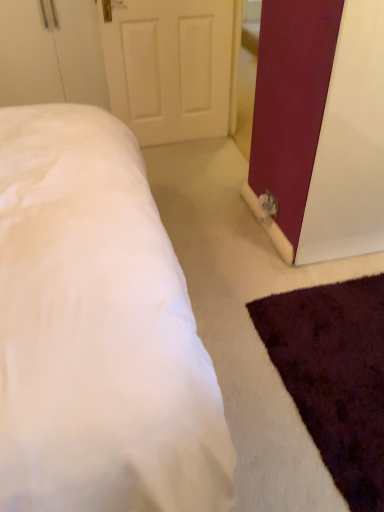
Question: Is matte burgundy barn door at right not inside white soft bed at lower left?

Choices:
 (A) yes
 (B) no

Answer: (A)

Question: From a real-world perspective, is matte burgundy barn door at right positioned over white soft bed at lower left based on gravity?

Choices:
 (A) yes
 (B) no

Answer: (A)

Question: Is matte burgundy barn door at right turned away from white soft bed at lower left?

Choices:
 (A) no
 (B) yes

Answer: (A)

Question: From a real-world perspective, is matte burgundy barn door at right positioned under white soft bed at lower left based on gravity?

Choices:
 (A) yes
 (B) no

Answer: (B)

Question: Does matte burgundy barn door at right come in front of white soft bed at lower left?

Choices:
 (A) yes
 (B) no

Answer: (B)

Question: Would you say white soft bed at lower left is to the left or to the right of matte burgundy barn door at right in the picture?

Choices:
 (A) right
 (B) left

Answer: (B)

Question: From the image's perspective, is white soft bed at lower left above or below matte burgundy barn door at right?

Choices:
 (A) below
 (B) above

Answer: (A)

Question: Considering the positions of white soft bed at lower left and matte burgundy barn door at right in the image, is white soft bed at lower left wider or thinner than matte burgundy barn door at right?

Choices:
 (A) thin
 (B) wide

Answer: (B)

Question: Is white soft bed at lower left taller or shorter than matte burgundy barn door at right?

Choices:
 (A) short
 (B) tall

Answer: (A)

Question: From the image's perspective, is white matte door at upper center located above or below white soft bed at lower left?

Choices:
 (A) above
 (B) below

Answer: (A)

Question: Is white matte door at upper center in front of or behind white soft bed at lower left in the image?

Choices:
 (A) front
 (B) behind

Answer: (B)

Question: Considering the positions of white matte door at upper center and white soft bed at lower left in the image, is white matte door at upper center bigger or smaller than white soft bed at lower left?

Choices:
 (A) big
 (B) small

Answer: (B)

Question: Considering the relative positions of white matte door at upper center and white soft bed at lower left in the image provided, is white matte door at upper center to the left or to the right of white soft bed at lower left?

Choices:
 (A) left
 (B) right

Answer: (A)

Question: Considering the positions of point (299, 225) and point (200, 117), is point (299, 225) closer or farther from the camera than point (200, 117)?

Choices:
 (A) closer
 (B) farther

Answer: (A)

Question: Based on their sizes in the image, would you say matte burgundy barn door at right is bigger or smaller than white matte door at upper center?

Choices:
 (A) small
 (B) big

Answer: (B)